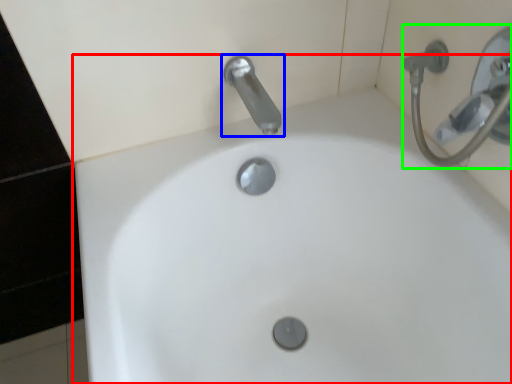
Question: Which object is the farthest from sink (highlighted by a red box)? Choose among these: tap (highlighted by a blue box) or shower (highlighted by a green box).

Choices:
 (A) tap
 (B) shower

Answer: (B)